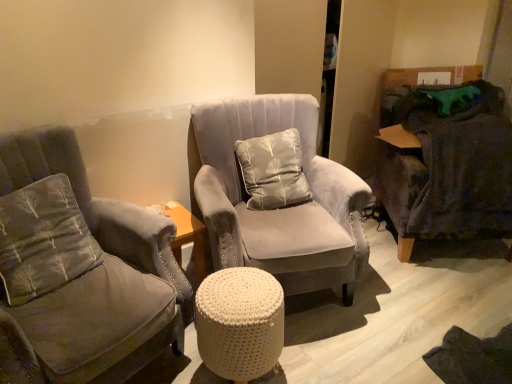
This screenshot has height=384, width=512. What do you see at coordinates (42, 240) in the screenshot?
I see `gray fabric pillow at left, the 1th pillow positioned from the front` at bounding box center [42, 240].

This screenshot has width=512, height=384. What do you see at coordinates (444, 160) in the screenshot?
I see `dark gray fabric swivel chair at right` at bounding box center [444, 160].

Measure the distance between light gray fabric pillow at center, which ranks as the first pillow in right-to-left order, and camera.

The distance of light gray fabric pillow at center, which ranks as the first pillow in right-to-left order, from camera is 1.99 meters.

Find the location of a particular element. gray fabric pillow at left, the 1th pillow positioned from the front is located at coordinates (42, 240).

Between light gray fabric pillow at center, which is the first pillow from back to front, and suede gray chair at center, the first chair in the right-to-left sequence, which one appears on the right side from the viewer's perspective?

From the viewer's perspective, suede gray chair at center, the first chair in the right-to-left sequence, appears more on the right side.

Is light gray fabric pillow at center, which is the 2th pillow from left to right, wider than suede gray chair at center, the second chair when ordered from left to right?

Incorrect, the width of light gray fabric pillow at center, which is the 2th pillow from left to right, does not surpass that of suede gray chair at center, the second chair when ordered from left to right.

Is light gray fabric pillow at center, which is the 2th pillow from left to right, positioned before suede gray chair at center, the second chair when ordered from left to right?

No, light gray fabric pillow at center, which is the 2th pillow from left to right, is further to the viewer.

How far apart are light gray fabric pillow at center, arranged as the second pillow when viewed from the front, and suede gray chair at center, the second chair when ordered from left to right?

The distance of light gray fabric pillow at center, arranged as the second pillow when viewed from the front, from suede gray chair at center, the second chair when ordered from left to right, is 6.85 inches.

Which of these two, velvet gray armchair at left, which is the 1th chair in left-to-right order, or dark gray fabric swivel chair at right, stands taller?

Standing taller between the two is velvet gray armchair at left, which is the 1th chair in left-to-right order.

Consider the image. Considering the relative positions of velvet gray armchair at left, arranged as the 2th chair when viewed from the right, and dark gray fabric swivel chair at right in the image provided, is velvet gray armchair at left, arranged as the 2th chair when viewed from the right, to the right of dark gray fabric swivel chair at right from the viewer's perspective?

In fact, velvet gray armchair at left, arranged as the 2th chair when viewed from the right, is to the left of dark gray fabric swivel chair at right.

Which object is closer to the camera, velvet gray armchair at left, arranged as the 2th chair when viewed from the right, or dark gray fabric swivel chair at right?

velvet gray armchair at left, arranged as the 2th chair when viewed from the right, is closer to the camera.

Between velvet gray armchair at left, arranged as the 2th chair when viewed from the right, and dark gray fabric swivel chair at right, which one has larger width?

Wider between the two is dark gray fabric swivel chair at right.

Is gray fabric pillow at left, the 1th pillow positioned from the front, taller than light gray fabric pillow at center, which is the first pillow from back to front?

Incorrect, the height of gray fabric pillow at left, the 1th pillow positioned from the front, is not larger of that of light gray fabric pillow at center, which is the first pillow from back to front.

Would you consider gray fabric pillow at left, placed as the 2th pillow when sorted from back to front, to be distant from light gray fabric pillow at center, which is the 2th pillow from left to right?

Actually, gray fabric pillow at left, placed as the 2th pillow when sorted from back to front, and light gray fabric pillow at center, which is the 2th pillow from left to right, are a little close together.

Can you confirm if gray fabric pillow at left, placed as the 2th pillow when sorted from back to front, is smaller than light gray fabric pillow at center, arranged as the second pillow when viewed from the front?

Yes.

From the image's perspective, would you say gray fabric pillow at left, placed as the 2th pillow when sorted from back to front, is positioned over light gray fabric pillow at center, arranged as the second pillow when viewed from the front?

No, from the image's perspective, gray fabric pillow at left, placed as the 2th pillow when sorted from back to front, is not over light gray fabric pillow at center, arranged as the second pillow when viewed from the front.

Is light gray fabric pillow at center, arranged as the second pillow when viewed from the front, turned away from gray fabric pillow at left, placed as the 2th pillow when sorted from back to front?

light gray fabric pillow at center, arranged as the second pillow when viewed from the front, does not have its back to gray fabric pillow at left, placed as the 2th pillow when sorted from back to front.

Can you tell me how much light gray fabric pillow at center, which is the 2th pillow from left to right, and gray fabric pillow at left, the 1th pillow positioned from the front, differ in facing direction?

The angular difference between light gray fabric pillow at center, which is the 2th pillow from left to right, and gray fabric pillow at left, the 1th pillow positioned from the front, is 38 degrees.

The image size is (512, 384). In the image, there is a gray fabric pillow at left, which is the 2th pillow in right-to-left order. Identify the location of pillow above it (from the image's perspective). 273,170.

Can you confirm if light gray fabric pillow at center, arranged as the second pillow when viewed from the front, is taller than gray fabric pillow at left, placed as the 2th pillow when sorted from back to front?

Correct, light gray fabric pillow at center, arranged as the second pillow when viewed from the front, is much taller as gray fabric pillow at left, placed as the 2th pillow when sorted from back to front.

Does point (170, 268) come behind point (253, 230)?

No, it is in front of (253, 230).

Does velvet gray armchair at left, arranged as the 2th chair when viewed from the right, have a greater width compared to suede gray chair at center, the first chair in the right-to-left sequence?

Indeed, velvet gray armchair at left, arranged as the 2th chair when viewed from the right, has a greater width compared to suede gray chair at center, the first chair in the right-to-left sequence.

Does velvet gray armchair at left, arranged as the 2th chair when viewed from the right, lie behind suede gray chair at center, the second chair when ordered from left to right?

No, it is in front of suede gray chair at center, the second chair when ordered from left to right.

Based on the photo, is velvet gray armchair at left, which is the 1th chair in left-to-right order, directly adjacent to suede gray chair at center, the first chair in the right-to-left sequence?

No, velvet gray armchair at left, which is the 1th chair in left-to-right order, is not beside suede gray chair at center, the first chair in the right-to-left sequence.

Considering the positions of objects white knitted pouf at center and light gray fabric pillow at center, which ranks as the first pillow in right-to-left order, in the image provided, who is in front, white knitted pouf at center or light gray fabric pillow at center, which ranks as the first pillow in right-to-left order,?

white knitted pouf at center is more forward.

Would you say light gray fabric pillow at center, arranged as the second pillow when viewed from the front, is part of white knitted pouf at center's contents?

No, white knitted pouf at center does not contain light gray fabric pillow at center, arranged as the second pillow when viewed from the front.

At what (x,y) coordinates should I click in order to perform the action: click on the 2nd pillow above the white knitted pouf at center (from the image's perspective). Please return your answer as a coordinate pair (x, y). The image size is (512, 384). Looking at the image, I should click on pos(273,170).

From the image's perspective, is white knitted pouf at center beneath light gray fabric pillow at center, which is the 2th pillow from left to right?

Yes, from the image's perspective, white knitted pouf at center is below light gray fabric pillow at center, which is the 2th pillow from left to right.

Between suede gray chair at center, the first chair in the right-to-left sequence, and light gray fabric pillow at center, which is the first pillow from back to front, which one is positioned behind?

light gray fabric pillow at center, which is the first pillow from back to front, is further away from the camera.

Can you confirm if suede gray chair at center, the first chair in the right-to-left sequence, is wider than light gray fabric pillow at center, which is the first pillow from back to front?

Correct, the width of suede gray chair at center, the first chair in the right-to-left sequence, exceeds that of light gray fabric pillow at center, which is the first pillow from back to front.

Between suede gray chair at center, the second chair when ordered from left to right, and light gray fabric pillow at center, which is the 2th pillow from left to right, which one has larger size?

Bigger between the two is suede gray chair at center, the second chair when ordered from left to right.

Would you say suede gray chair at center, the first chair in the right-to-left sequence, is a long distance from light gray fabric pillow at center, arranged as the second pillow when viewed from the front?

They are positioned close to each other.

The height and width of the screenshot is (384, 512). Identify the location of pillow behind the suede gray chair at center, the first chair in the right-to-left sequence. (273, 170).

At what (x,y) coordinates should I click in order to perform the action: click on the 2nd chair counting from the left of the dark gray fabric swivel chair at right. Please return your answer as a coordinate pair (x, y). This screenshot has height=384, width=512. Looking at the image, I should click on (81, 269).

Considering their positions, is dark gray fabric swivel chair at right positioned further to suede gray chair at center, the first chair in the right-to-left sequence, than white knitted pouf at center?

dark gray fabric swivel chair at right is positioned further to the anchor suede gray chair at center, the first chair in the right-to-left sequence.

Based on their spatial positions, is suede gray chair at center, the first chair in the right-to-left sequence, or velvet gray armchair at left, arranged as the 2th chair when viewed from the right, further from gray fabric pillow at left, placed as the 2th pillow when sorted from back to front?

suede gray chair at center, the first chair in the right-to-left sequence.

Which object lies further to the anchor point suede gray chair at center, the second chair when ordered from left to right, gray fabric pillow at left, the 1th pillow positioned from the front, or white knitted pouf at center?

gray fabric pillow at left, the 1th pillow positioned from the front, is positioned further to the anchor suede gray chair at center, the second chair when ordered from left to right.

Looking at this image, when comparing their distances from velvet gray armchair at left, which is the 1th chair in left-to-right order, does suede gray chair at center, the second chair when ordered from left to right, or dark gray fabric swivel chair at right seem closer?

Based on the image, suede gray chair at center, the second chair when ordered from left to right, appears to be nearer to velvet gray armchair at left, which is the 1th chair in left-to-right order.

Estimate the real-world distances between objects in this image. Which object is closer to suede gray chair at center, the second chair when ordered from left to right, dark gray fabric swivel chair at right or light gray fabric pillow at center, which is the 2th pillow from left to right?

light gray fabric pillow at center, which is the 2th pillow from left to right, is positioned closer to the anchor suede gray chair at center, the second chair when ordered from left to right.

Looking at the image, which one is located closer to suede gray chair at center, the first chair in the right-to-left sequence, velvet gray armchair at left, arranged as the 2th chair when viewed from the right, or gray fabric pillow at left, the 1th pillow positioned from the front?

velvet gray armchair at left, arranged as the 2th chair when viewed from the right, is positioned closer to the anchor suede gray chair at center, the first chair in the right-to-left sequence.

From the image, which object appears to be farther from white knitted pouf at center, gray fabric pillow at left, which is the 2th pillow in right-to-left order, or suede gray chair at center, the first chair in the right-to-left sequence?

Among the two, gray fabric pillow at left, which is the 2th pillow in right-to-left order, is located further to white knitted pouf at center.

Which object lies nearer to the anchor point velvet gray armchair at left, arranged as the 2th chair when viewed from the right, white knitted pouf at center or dark gray fabric swivel chair at right?

The object closer to velvet gray armchair at left, arranged as the 2th chair when viewed from the right, is white knitted pouf at center.

Image resolution: width=512 pixels, height=384 pixels. Identify the location of chair situated between gray fabric pillow at left, the first pillow viewed from the left, and white knitted pouf at center from left to right. (81, 269).

Locate an element on the screen. table between velvet gray armchair at left, arranged as the 2th chair when viewed from the right, and suede gray chair at center, the second chair when ordered from left to right, from left to right is located at coordinates (240, 323).

At what (x,y) coordinates should I click in order to perform the action: click on table positioned between velvet gray armchair at left, which is the 1th chair in left-to-right order, and light gray fabric pillow at center, which ranks as the first pillow in right-to-left order, from near to far. Please return your answer as a coordinate pair (x, y). Looking at the image, I should click on (240, 323).

Locate an element on the screen. The image size is (512, 384). chair situated between white knitted pouf at center and dark gray fabric swivel chair at right from left to right is located at coordinates (278, 209).